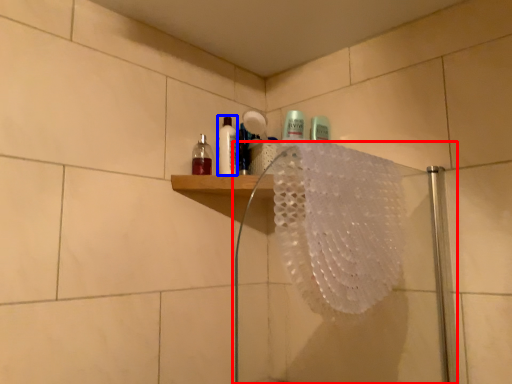
Question: Which object is closer to the camera taking this photo, shower door (highlighted by a red box) or mouthwash (highlighted by a blue box)?

Choices:
 (A) shower door
 (B) mouthwash

Answer: (A)